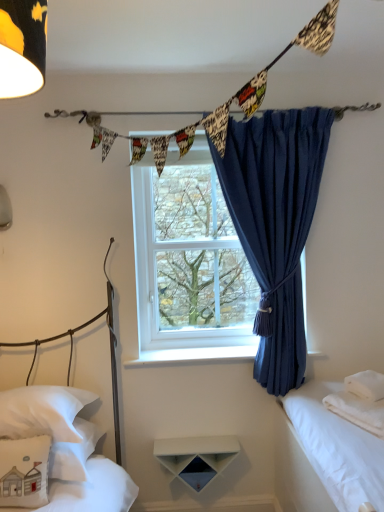
Locate an element on the screen. The width and height of the screenshot is (384, 512). vacant point above white matte shelf at center (from a real-world perspective) is located at coordinates point(198,442).